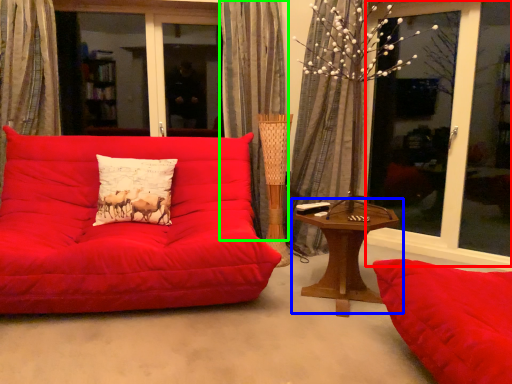
Question: Based on their relative distances, which object is nearer to window screen (highlighted by a red box)? Choose from table (highlighted by a blue box) and curtain (highlighted by a green box).

Choices:
 (A) table
 (B) curtain

Answer: (A)